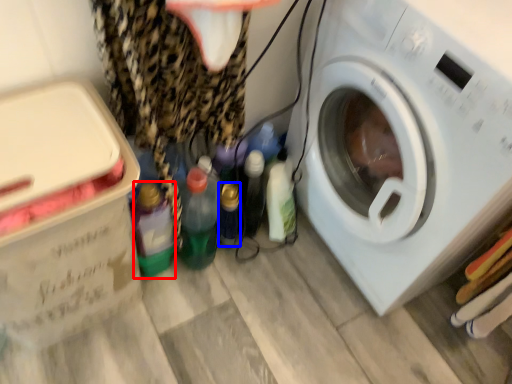
Question: Among these objects, which one is nearest to the camera, bottle (highlighted by a red box) or bottle (highlighted by a blue box)?

Choices:
 (A) bottle
 (B) bottle

Answer: (A)